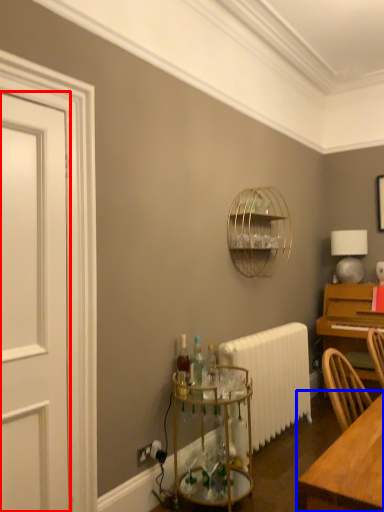
Question: Which object is further to the camera taking this photo, door (highlighted by a red box) or table (highlighted by a blue box)?

Choices:
 (A) door
 (B) table

Answer: (A)